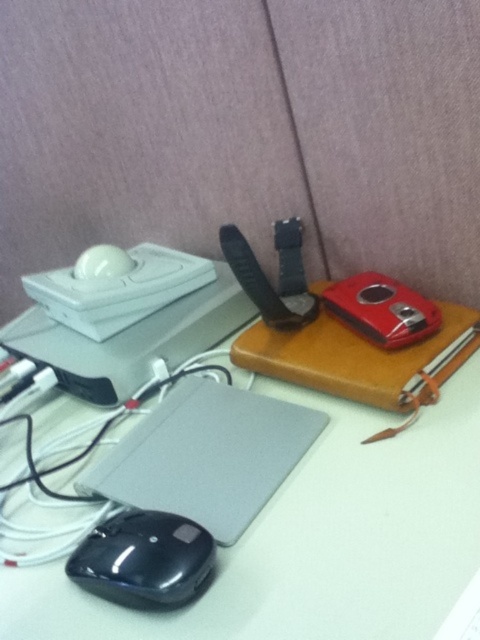
You are organizing the desk and need to place a new item between the satin black laptop at lower left and the black matte mouse at lower left. Is there enough space between them for the new item?

The satin black laptop at lower left is to the right of the black matte mouse at lower left, so there is space between them to place the new item.

You are organizing items on the desk and need to place a new object between the white matte table at center and the black matte mouse at lower left. Is there enough space between them to place this new object?

The white matte table at center is positioned over the black matte mouse at lower left, meaning there is no space between them to place a new object.